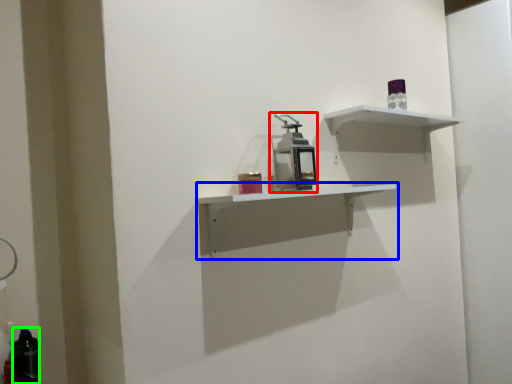
Question: Estimate the real-world distances between objects in this image. Which object is closer to medicine cabinet (highlighted by a red box), shelf (highlighted by a blue box) or bottle (highlighted by a green box)?

Choices:
 (A) shelf
 (B) bottle

Answer: (A)